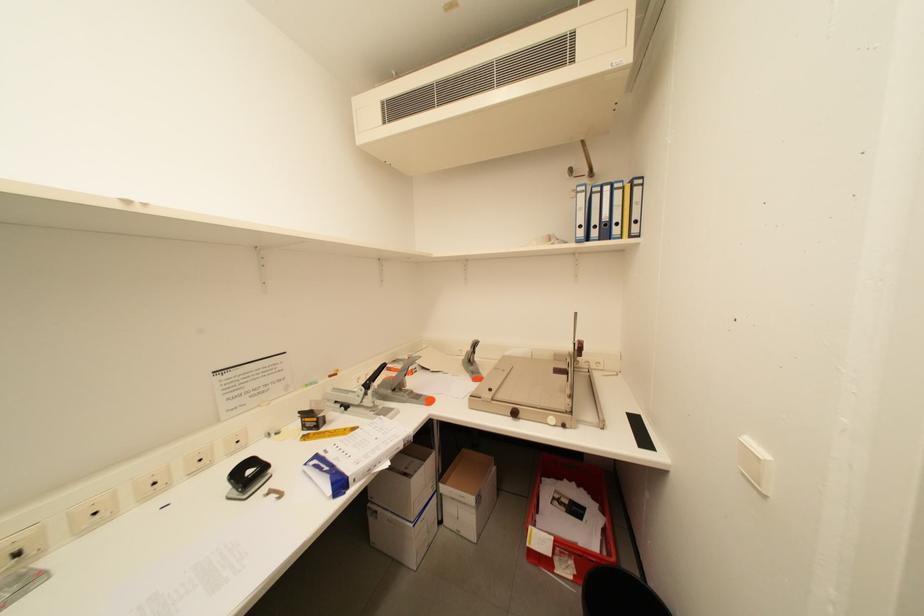
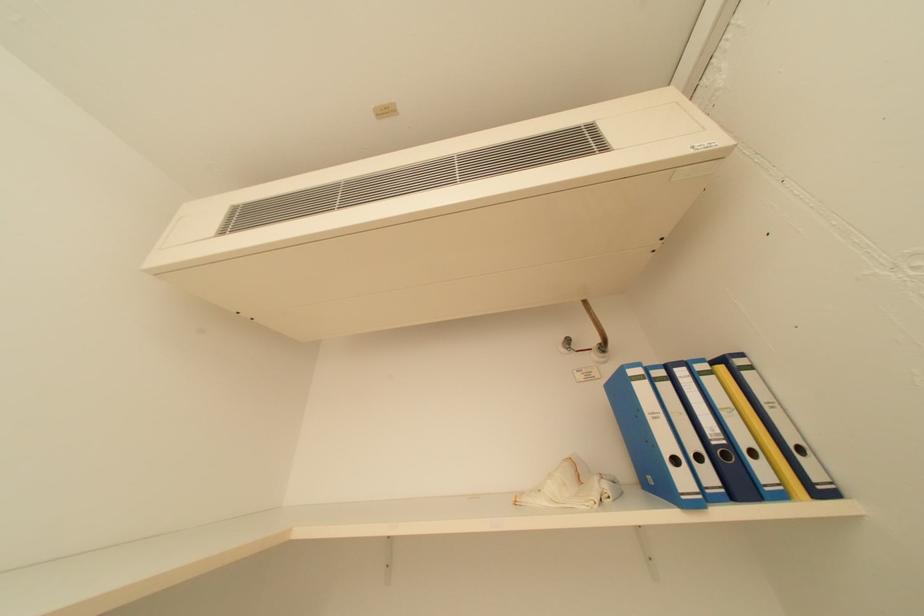
Question: How did the camera likely rotate?

Choices:
 (A) Left
 (B) Right
 (C) Up
 (D) Down

Answer: (C)